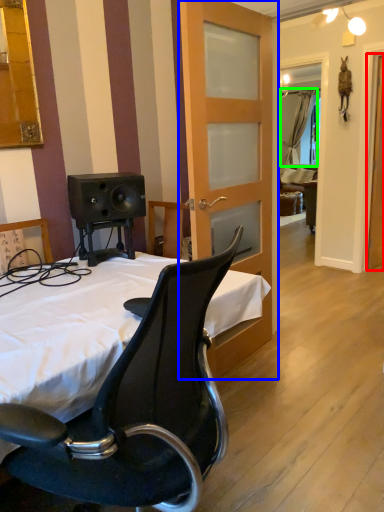
Question: Which object is positioned farthest from screen door (highlighted by a red box)? Select from door (highlighted by a blue box) and curtain (highlighted by a green box).

Choices:
 (A) door
 (B) curtain

Answer: (B)